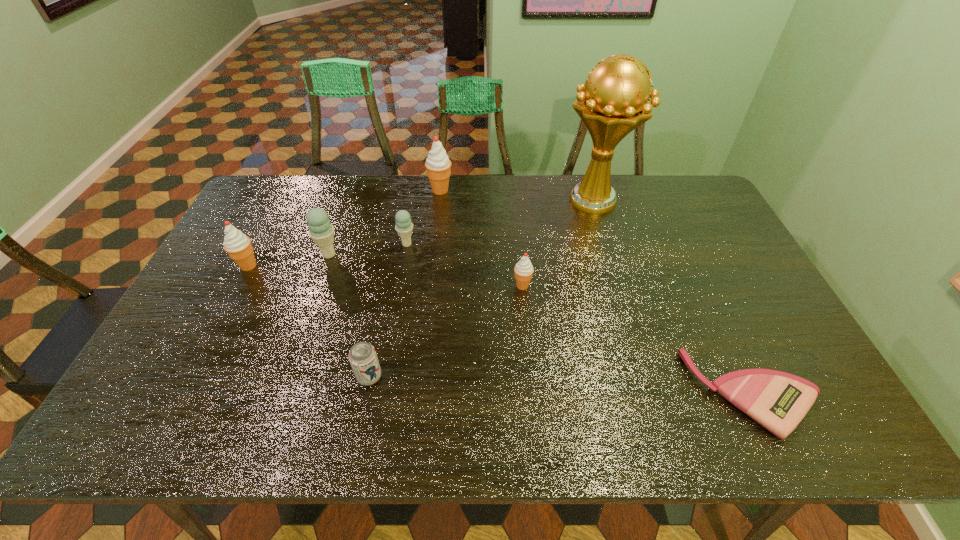
I want to click on blank area at the near edge, so click(724, 438).

I want to click on vacant region at the left edge of the desktop, so click(240, 291).

Locate an element on the screen. The height and width of the screenshot is (540, 960). vacant space at the right edge is located at coordinates (733, 261).

Where is `vacant space at the far left corner of the desktop`? This screenshot has width=960, height=540. vacant space at the far left corner of the desktop is located at coordinates (273, 189).

Find the location of `free space at the far right corner of the desktop`. free space at the far right corner of the desktop is located at coordinates (708, 199).

Find the location of a particular element. This screenshot has width=960, height=540. free space between the seventh object from right to left and the nearest red icecream is located at coordinates (425, 270).

Where is `blank region between the left blue ice cream and the nearest red icecream`? This screenshot has width=960, height=540. blank region between the left blue ice cream and the nearest red icecream is located at coordinates (425, 270).

Locate an element on the screen. empty space between the shortest object and the beer can is located at coordinates (562, 385).

Where is `free space between the shortest object and the leftmost red icecream`? free space between the shortest object and the leftmost red icecream is located at coordinates (501, 329).

What are the coordinates of `free area in between the wristlet and the tallest object` in the screenshot? It's located at pyautogui.click(x=673, y=297).